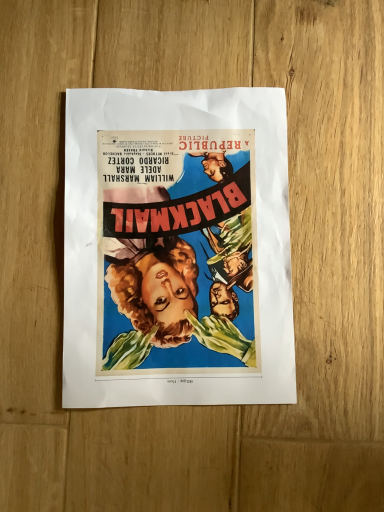
What is the approximate width of vibrant paper poster at center?

12.10 inches.

Image resolution: width=384 pixels, height=512 pixels. Find the location of `vibrant paper poster at center`. vibrant paper poster at center is located at coordinates (96, 238).

Describe the element at coordinates (96, 238) in the screenshot. The image size is (384, 512). I see `vibrant paper poster at center` at that location.

Measure the distance between point (265,338) and camera.

They are 15.28 inches apart.

Where is `vibrant paper poster at center`? vibrant paper poster at center is located at coordinates (96, 238).